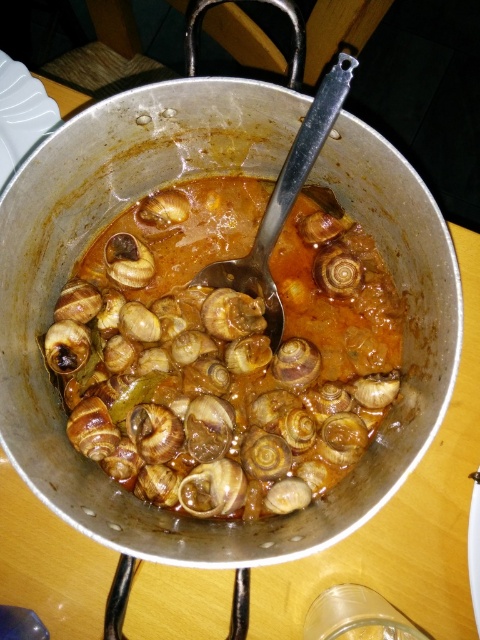
From the picture: You are a chef preparing a dish and need to select the larger snail from the pot. Which one should you choose between the shiny brown snail at center and the matte brown snail at center?

The shiny brown snail at center is wider than the matte brown snail at center, so you should choose the shiny brown snail at center.

You are a chef preparing to serve the dish. You need to pick up the shiny brown snail at center and the matte brown snail at center using a pair of tongs. Which snail will be easier to reach?

The shiny brown snail at center will be easier to reach because it is closer to the viewer than the matte brown snail at center.